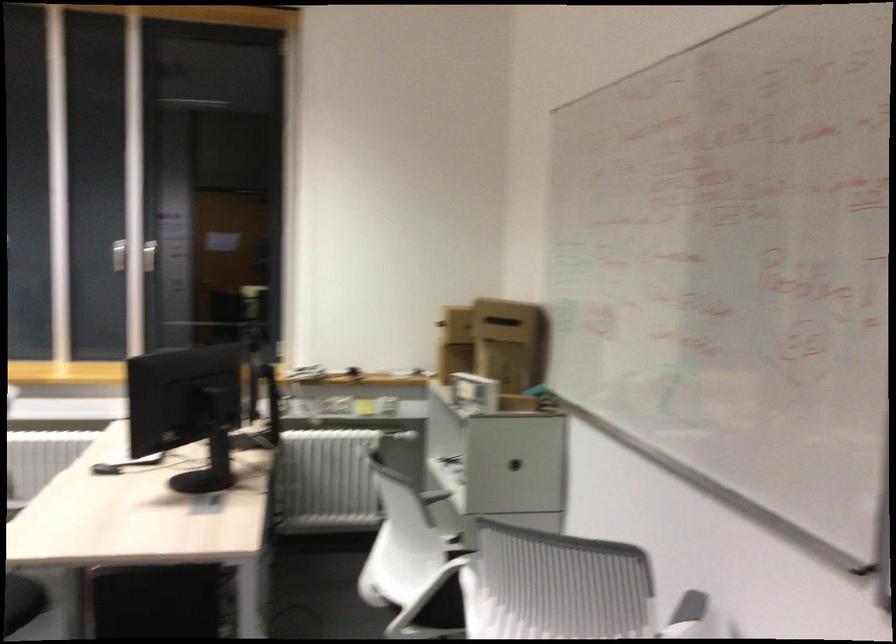
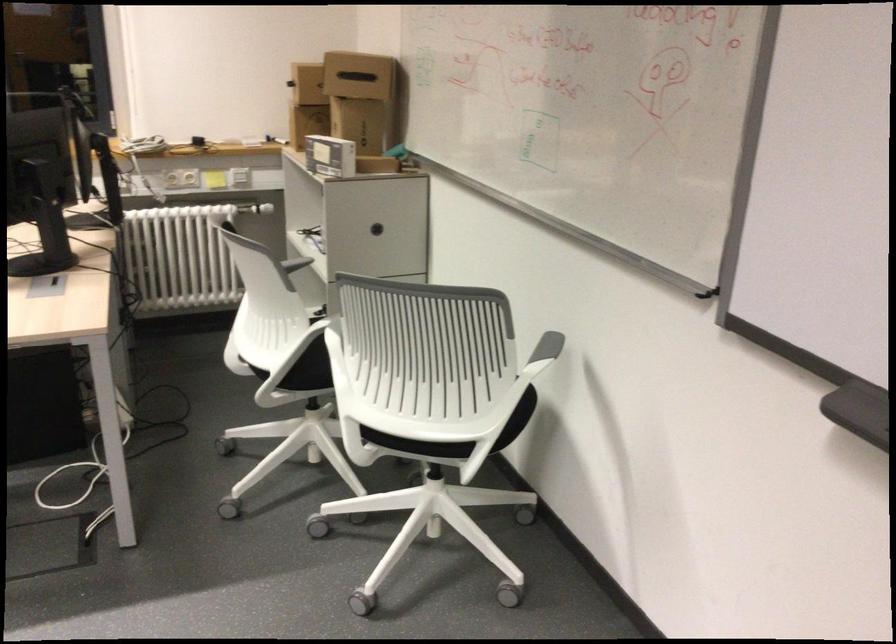
Find the pixel in the second image that matches point 446,315 in the first image.

(307, 84)